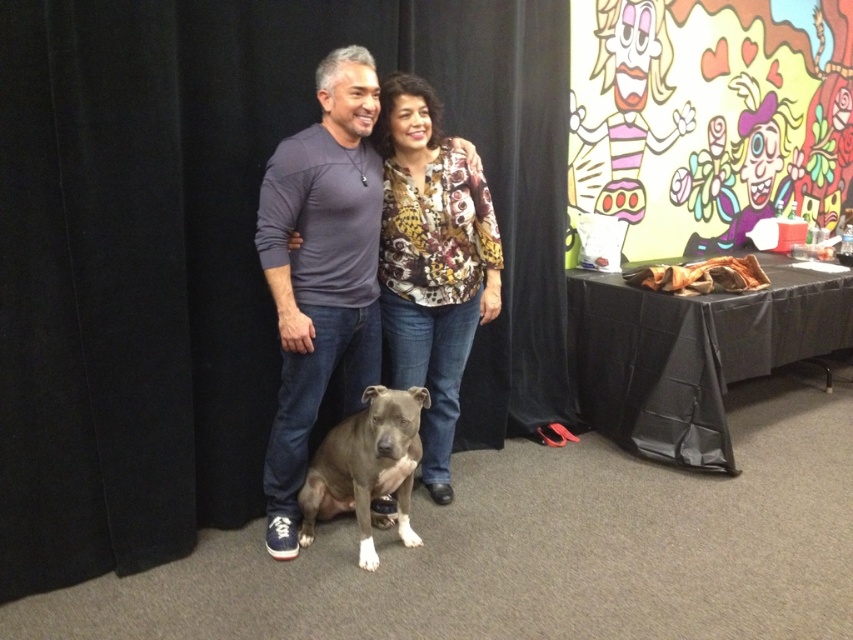
You are a photographer setting up a shot. You have a printed fabric blouse at center and a gray matte dog at lower center in the frame. Which object is taller in the scene?

The printed fabric blouse at center is taller than the gray matte dog at lower center according to the description.

You are a photographer trying to capture a closeup of the matte gray dog at center. The camera you are using has a focal length of 50mm and a sensor size of 24mm x 36mm. The dog is positioned at point (320, 272) in the image coordinates. To ensure the dog fills the frame appropriately, you need to calculate the distance from the camera to the dog. Given that the dog occupies 200 pixels in height in the image, and the sensor can resolve 6000 pixels per inch, what is the minimum distance in meters you need?

The point (320, 272) corresponds to the matte gray dog at center. To calculate the minimum distance, first determine the sensor height in inches. The sensor is 24mm tall, which converts to approximately 0.9449 inches. At 6000 pixels per inch, the total vertical pixels are 6000 x 0.9449. The dog occupies 200 pixels, so its proportion is 200 divided by total pixels. Using the formula distance equals focal length divided by proportion, the minimum distance required is approximately 0.7 meters.

You are standing in the room where the matte gray dog at center is located. If you face the direction the dog is looking, which direction would you be facing relative to the room?

The matte gray dog at center is positioned at point (320, 272), so facing the direction the dog is looking would mean facing the camera, which is typically considered the front direction in such photographs.